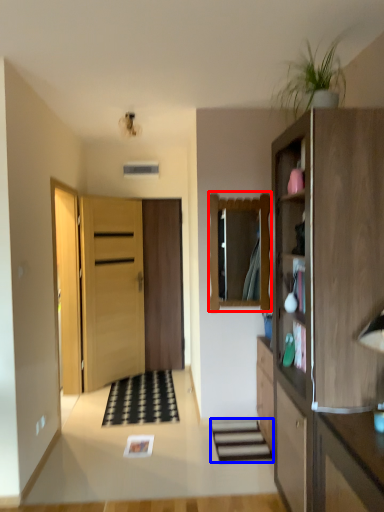
Question: Which point is closer to the camera, mirror (highlighted by a red box) or stairwell (highlighted by a blue box)?

Choices:
 (A) mirror
 (B) stairwell

Answer: (B)